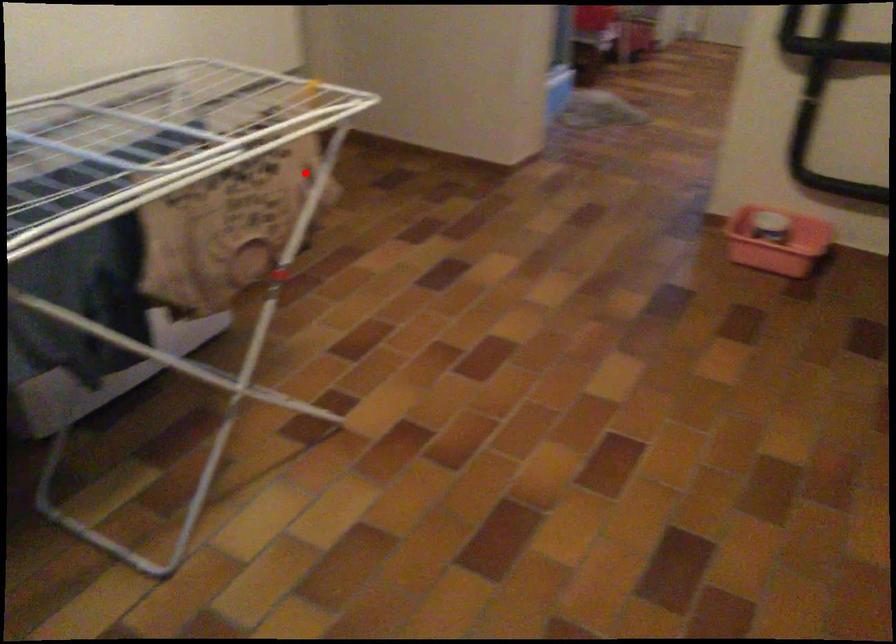
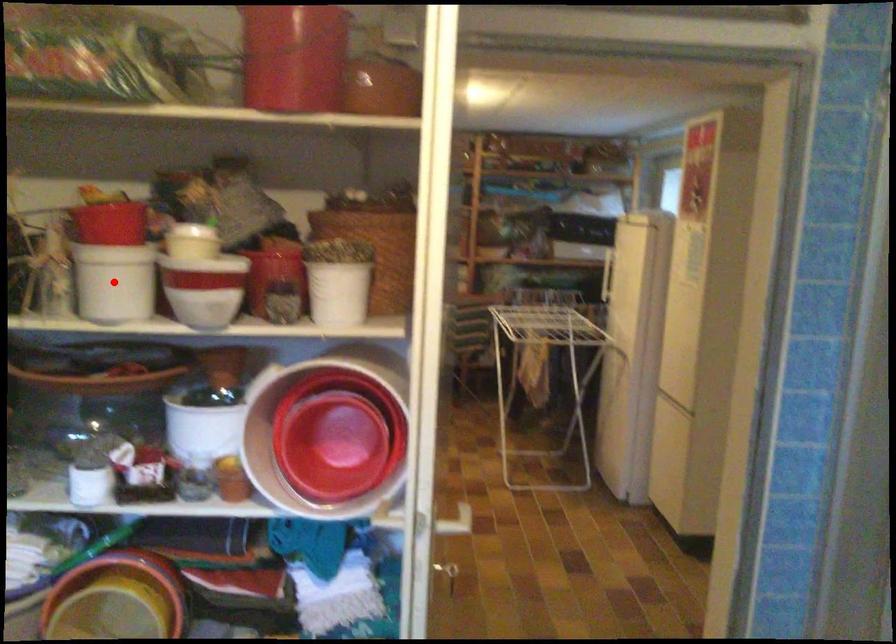
I am providing you with two images of the same scene from different viewpoints. A red point is marked on the first image and another point is marked on the second image. Do the highlighted points in image1 and image2 indicate the same real-world spot?

No